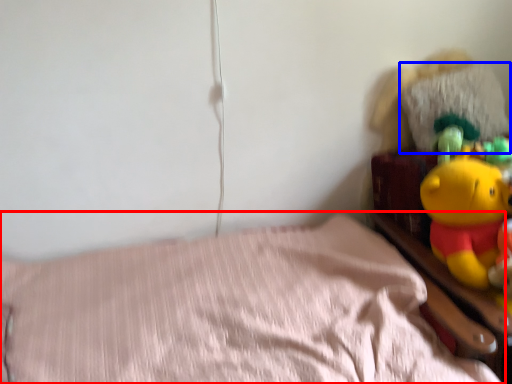
Question: Which object appears farthest to the camera in this image, bed (highlighted by a red box) or pillow (highlighted by a blue box)?

Choices:
 (A) bed
 (B) pillow

Answer: (B)